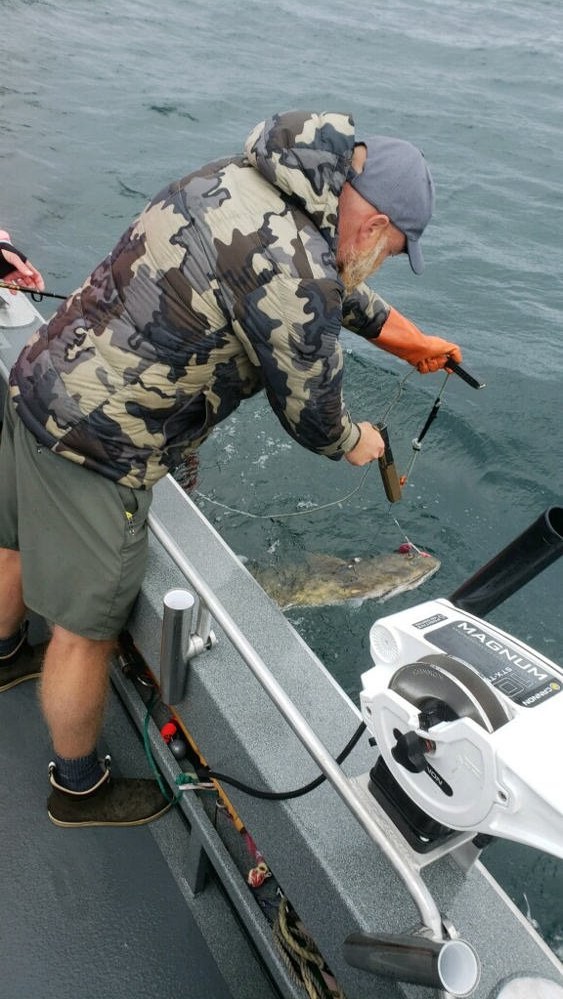
You are a GUI agent. You are given a task and a screenshot of the screen. Output one action in this format:
    pyautogui.click(x=<x>, y=<y>)
    Task: Click on the sock
    This screenshot has width=563, height=999.
    Given the screenshot: What is the action you would take?
    pyautogui.click(x=79, y=764), pyautogui.click(x=6, y=643)